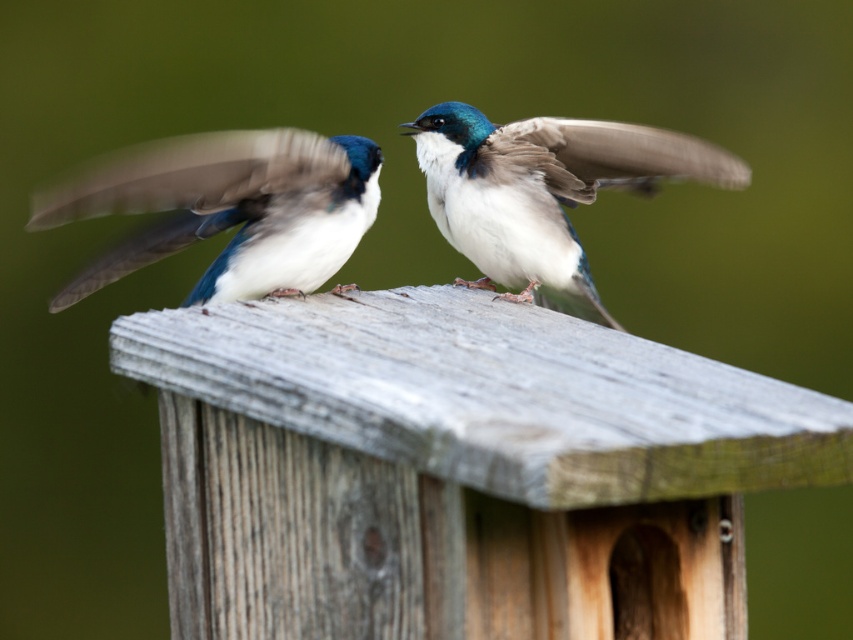
Between point (120, 204) and point (544, 138), which one is positioned behind?

Point (544, 138)

Consider the image. Is white matte bird at center shorter than shiny blue-green bird at center?

Correct, white matte bird at center is not as tall as shiny blue-green bird at center.

Does point (215, 186) come in front of point (654, 161)?

Yes, it is.

Identify the location of white matte bird at center. pos(228,209).

Is white matte bird at center positioned at the back of smooth feathered wing at center?

That is False.

Between white matte bird at center and smooth feathered wing at center, which one is positioned lower?

white matte bird at center is below.

Is point (314, 256) positioned before point (540, 170)?

Yes, point (314, 256) is closer to viewer.

Locate an element on the screen. white matte bird at center is located at coordinates (228, 209).

Can you confirm if shiny blue-green bird at center is smaller than smooth feathered wing at center?

Incorrect, shiny blue-green bird at center is not smaller in size than smooth feathered wing at center.

Describe the element at coordinates (544, 193) in the screenshot. Image resolution: width=853 pixels, height=640 pixels. I see `shiny blue-green bird at center` at that location.

Identify the location of shiny blue-green bird at center. (544, 193).